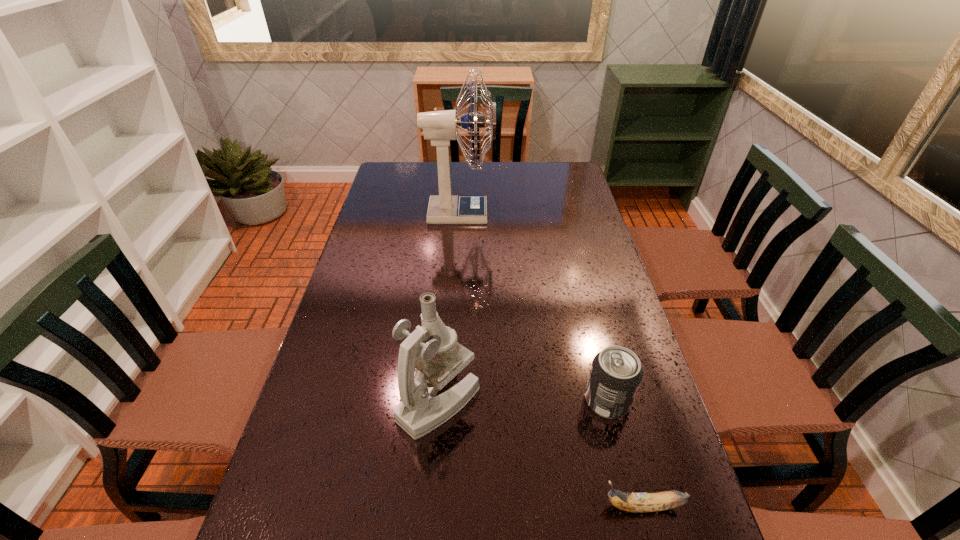
Find the location of `the tallest object`. the tallest object is located at coordinates (440, 127).

The image size is (960, 540). Find the location of `the farthest object`. the farthest object is located at coordinates (440, 127).

Identify the location of microscope. This screenshot has width=960, height=540. (420, 411).

Where is `soda can`? soda can is located at coordinates (616, 373).

At what (x,y) coordinates should I click in order to perform the action: click on the nearest object. Please return your answer as a coordinate pair (x, y). Looking at the image, I should click on (631, 502).

In order to click on the shortest object in this screenshot , I will do `click(631, 502)`.

I want to click on vacant space located 0.280m on the front-facing side of the fan, so click(x=573, y=213).

This screenshot has height=540, width=960. What are the coordinates of `free space located on the back of the third shortest object` in the screenshot? It's located at (448, 287).

Image resolution: width=960 pixels, height=540 pixels. Find the location of `vacant space located on the left of the soda can`. vacant space located on the left of the soda can is located at coordinates (494, 401).

Locate an element on the screen. free space located 0.120m at the stem of the nearest object is located at coordinates (537, 506).